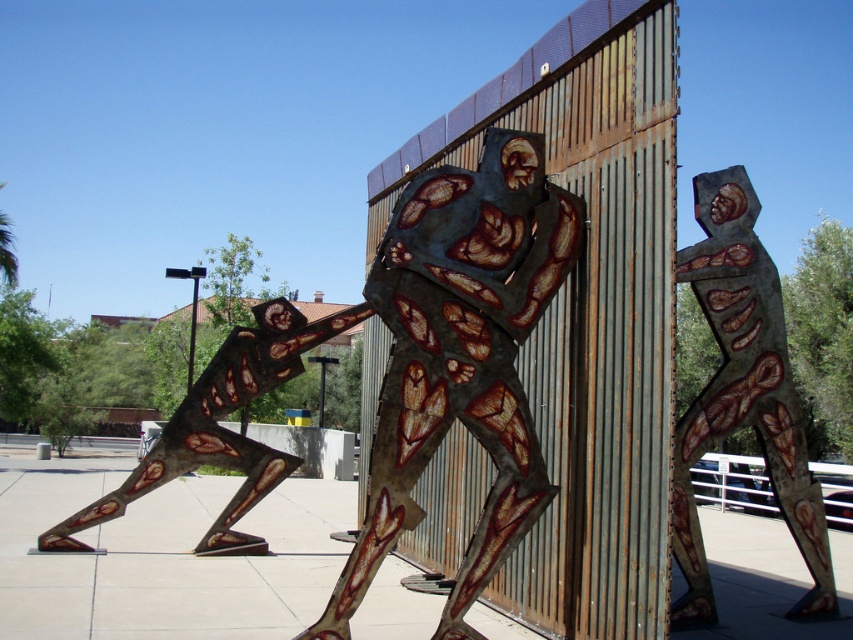
Question: Does rusty metal figure at center appear on the left side of rusty metal figure at upper right?

Choices:
 (A) no
 (B) yes

Answer: (B)

Question: Which point is farther to the camera?

Choices:
 (A) rusty metal figure at center
 (B) rusty metal figure at upper right

Answer: (B)

Question: Does rusty metal figure at center lie behind rusty metal figure at upper right?

Choices:
 (A) yes
 (B) no

Answer: (B)

Question: Among these objects, which one is nearest to the camera?

Choices:
 (A) rusty metal figure at upper right
 (B) rusty metal figure at center

Answer: (B)

Question: Does rusty metal figure at center appear on the right side of rusty metal figure at upper right?

Choices:
 (A) no
 (B) yes

Answer: (A)